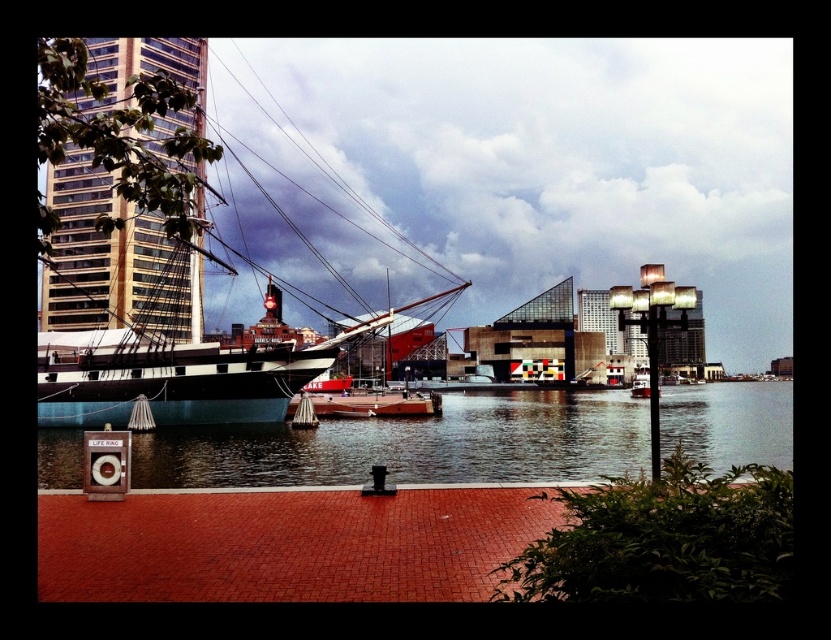
You are standing at the waterfront scene described. You want to reach the point marked as point [58,419]. If your walking speed is 1.5 meters per second, how many seconds will it take you to reach that point?

The distance between you and point [58,419] is 62.18 meters. At a walking speed of 1.5 meters per second, it would take approximately 41.45 seconds to reach the point.

You are standing on the waterfront and want to place a rectangular picnic blanket that is 2 meters wide between the brick at lower center and the clear water at center. Based on their widths, will the picnic blanket fit between them?

The brick at lower center has a lesser width compared to clear water at center. Since the brick is narrower, the 2 meter wide picnic blanket may fit between them if the combined width of the brick and the water allows enough space. However, without knowing the exact widths of each, it is impossible to determine definitively.